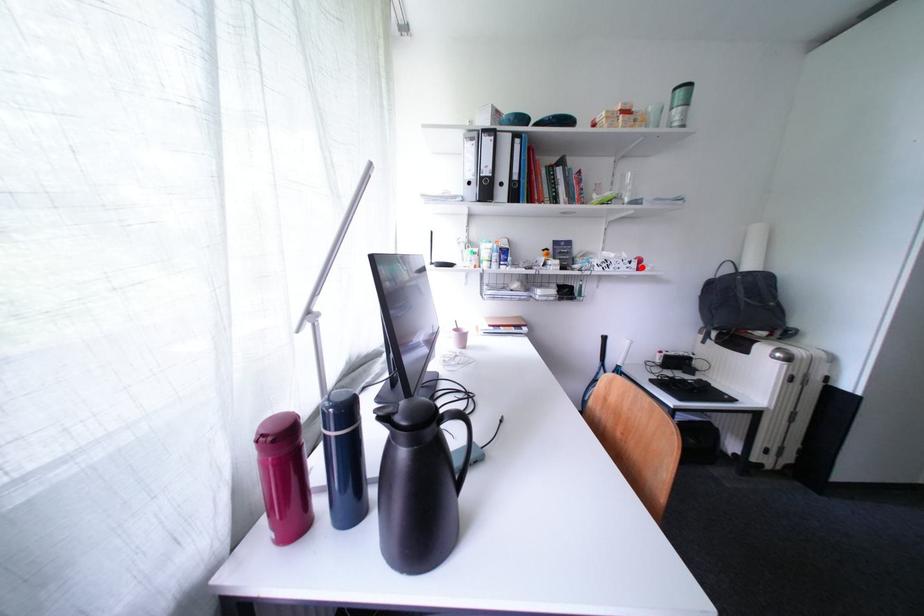
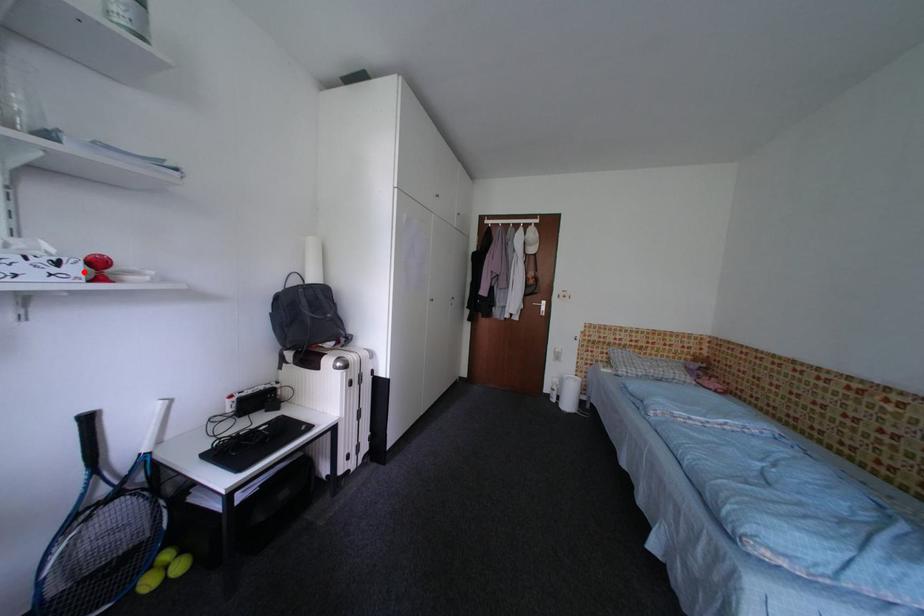
I am providing you with two images of the same scene from different viewpoints. A red point is marked on the first image and another point is marked on the second image. Does the point marked in image1 correspond to the same location as the one in image2?

Yes